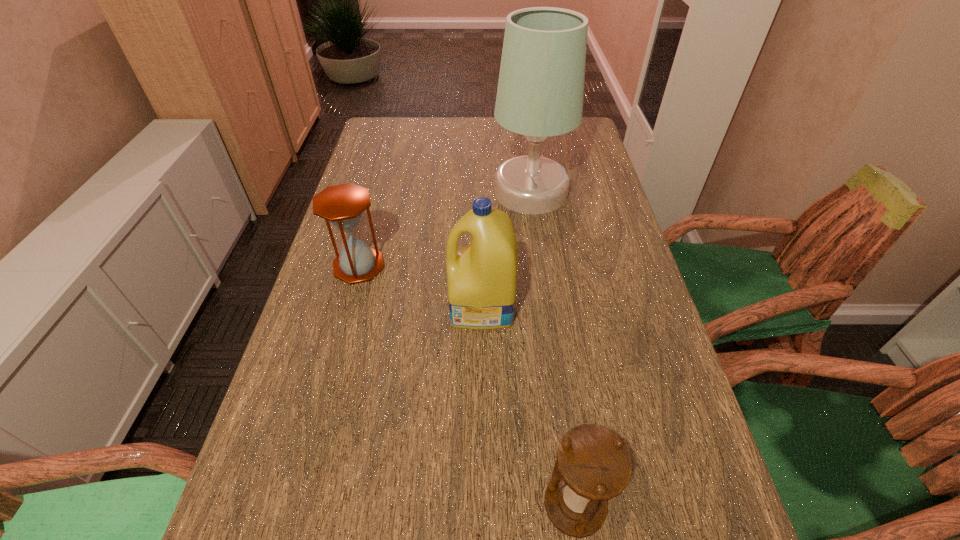
In order to click on lampshade in this screenshot , I will do `click(540, 92)`.

Where is `the farthest object`? This screenshot has width=960, height=540. the farthest object is located at coordinates (540, 92).

Locate an element on the screen. Image resolution: width=960 pixels, height=540 pixels. the third shortest object is located at coordinates pos(481,277).

At what (x,y) coordinates should I click in order to perform the action: click on the leftmost object. Please return your answer as a coordinate pair (x, y). The height and width of the screenshot is (540, 960). Looking at the image, I should click on (342, 205).

You are a GUI agent. You are given a task and a screenshot of the screen. Output one action in this format:
    pyautogui.click(x=<x>, y=<y>)
    Task: Click on the farther hourglass
    
    Given the screenshot: What is the action you would take?
    pyautogui.click(x=342, y=205)

Where is `the nearest object`? the nearest object is located at coordinates pos(593,465).

This screenshot has height=540, width=960. What are the coordinates of `the right hourglass` in the screenshot? It's located at (593, 465).

Where is `vacant region located on the base of the tallest object`? The width and height of the screenshot is (960, 540). vacant region located on the base of the tallest object is located at coordinates (379, 192).

You are a GUI agent. You are given a task and a screenshot of the screen. Output one action in this format:
    pyautogui.click(x=<x>, y=<y>)
    Task: Click on the free space located 0.360m on the base of the tallest object
    The width and height of the screenshot is (960, 540).
    Given the screenshot: What is the action you would take?
    pyautogui.click(x=372, y=192)

Identify the location of vacant region located 0.330m on the base of the tallest object. (382, 192).